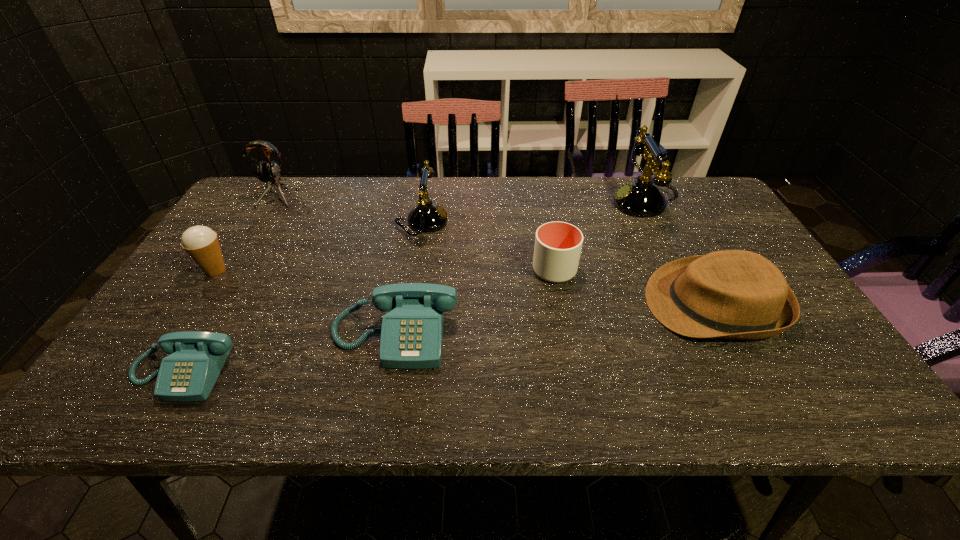
Identify which telephone is the closest to the smaller blue telephone. Please provide its 2D coordinates. Your answer should be formatted as a tuple, i.e. [(x, y)], where the tuple contains the x and y coordinates of a point satisfying the conditions above.

[(412, 331)]